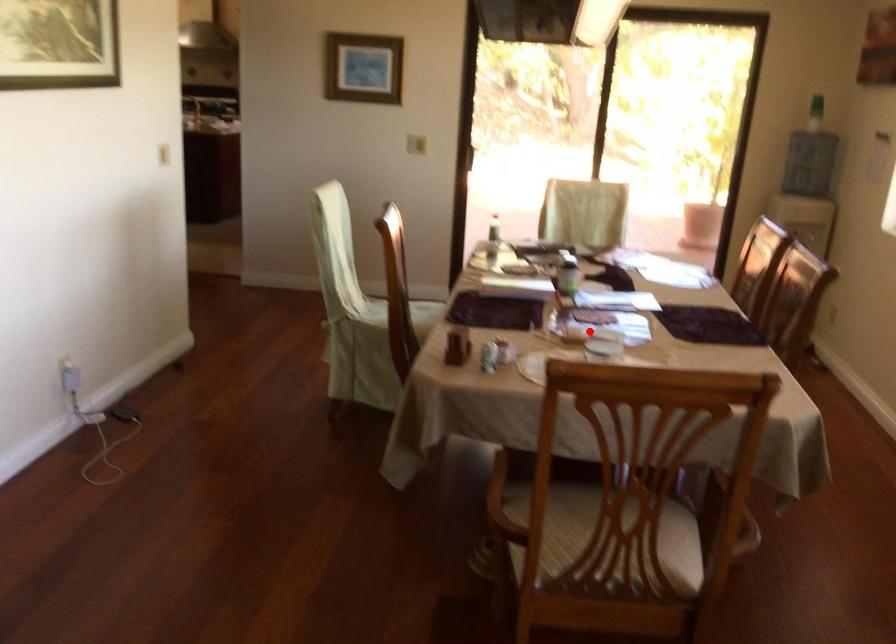
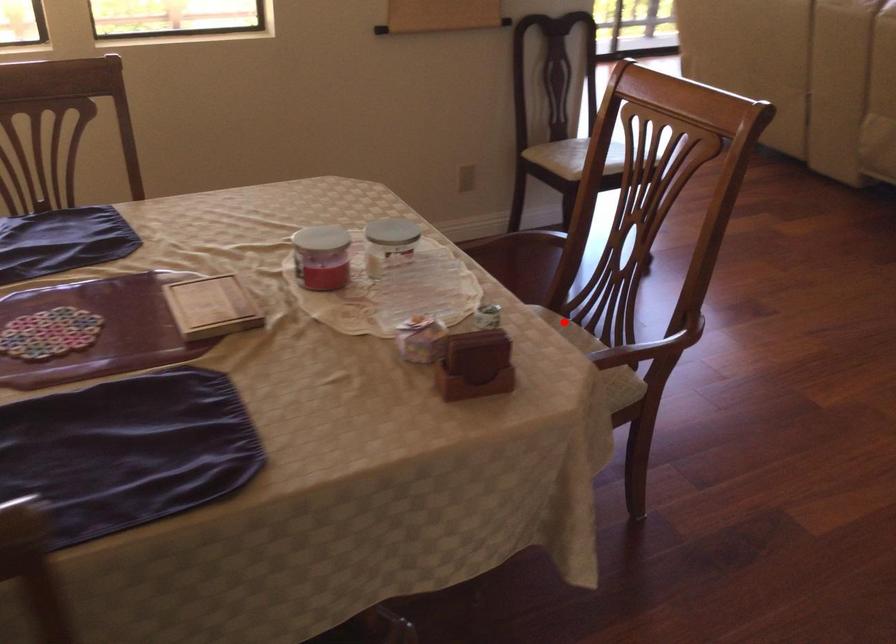
I am providing you with two images of the same scene from different viewpoints. A red point is marked on the first image and another point is marked on the second image. Is the marked point in image1 the same physical position as the marked point in image2?

No